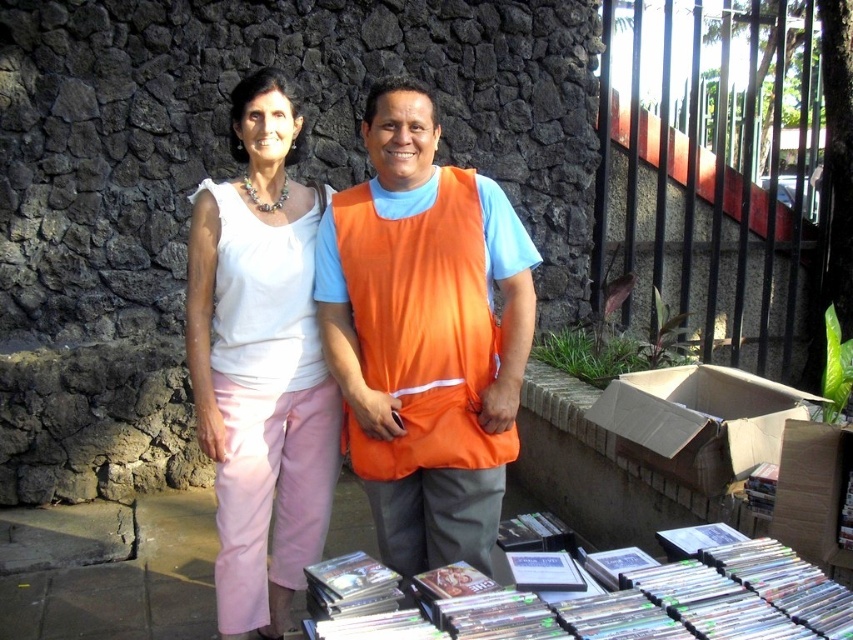
Based on the photo, you are a photographer trying to capture a closeup of the orange fabric vest at center and the clear plastic dvds at lower center. Since you want both objects to be equally visible in the photo, which object should you zoom in on more?

The orange fabric vest at center is smaller in width than the clear plastic dvds at lower center. To make both objects equally visible, you should zoom in more on the orange fabric vest at center to enlarge its appearance in the photo.

You are a photographer setting up a shot of the clear plastic dvds at lower center. The camera is positioned at point 0.0, 0.0. What direction should you move the camera to align it with the dvds?

The clear plastic dvds at lower center are located at point (628, 604). To align the camera at (0, 0) with them, move the camera to the right and upwards since the dvds are at a higher x and y coordinate.